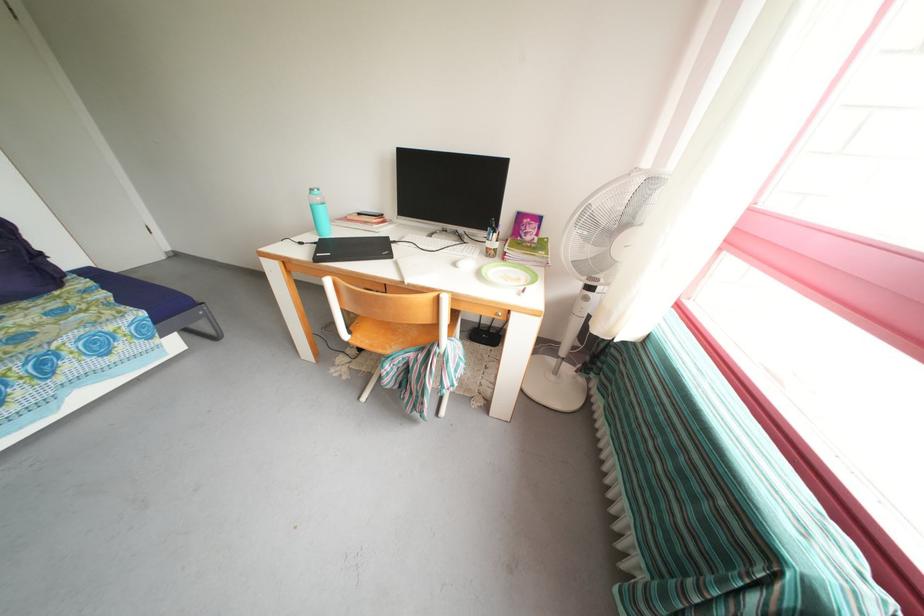
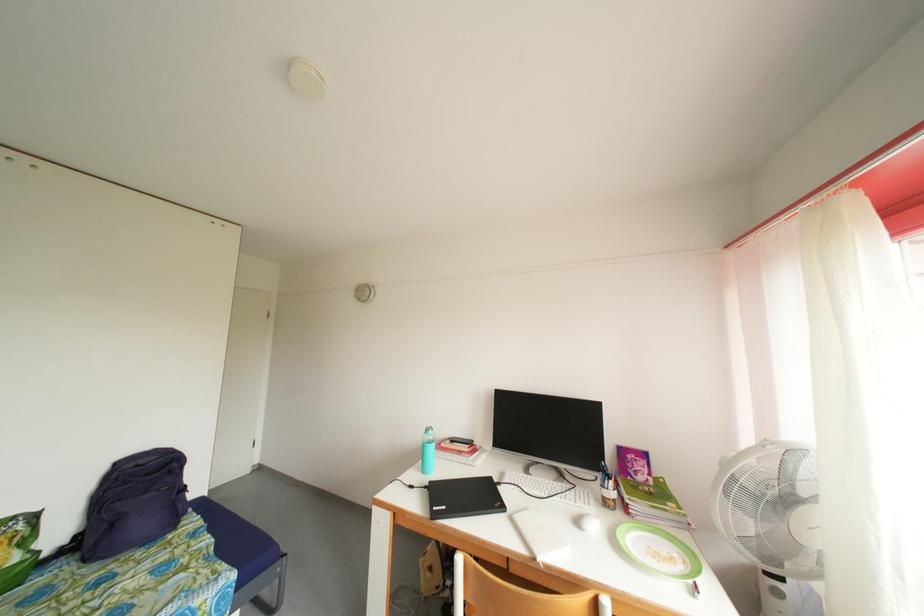
The point at (322,249) is marked in the first image. Where is the corresponding point in the second image?

(432, 493)